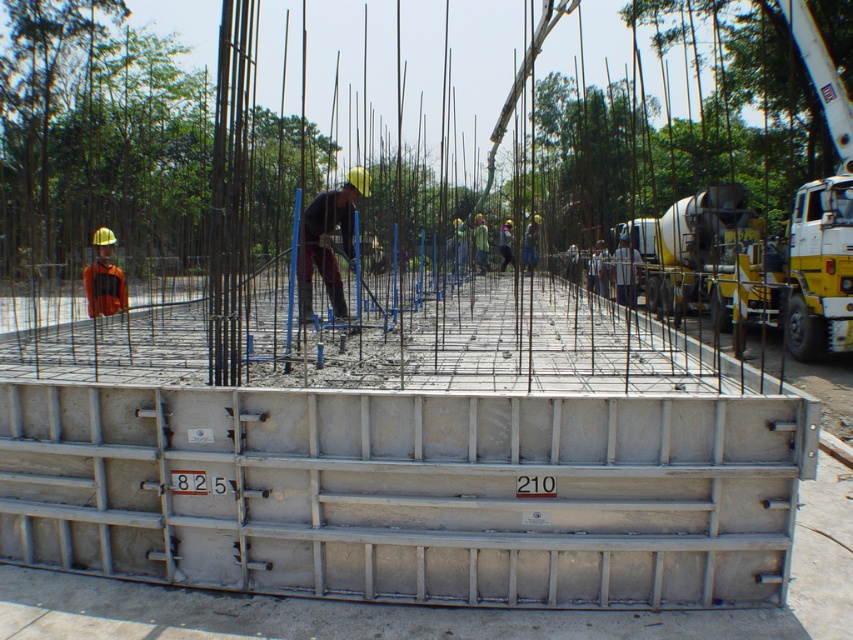
Who is higher up, silver metallic foundation at center or orange reflective vest at left?

Positioned higher is orange reflective vest at left.

Find the location of a particular element. silver metallic foundation at center is located at coordinates (409, 492).

Does point (366, 477) come farther from viewer compared to point (94, 304)?

No, it is in front of (94, 304).

At what (x,y) coordinates should I click in order to perform the action: click on silver metallic foundation at center. Please return your answer as a coordinate pair (x, y). This screenshot has width=853, height=640. Looking at the image, I should click on (409, 492).

Is silver metallic foundation at center above matte black helmet at center?

Incorrect, silver metallic foundation at center is not positioned above matte black helmet at center.

Who is more forward, [692,579] or [347,177]?

Point [692,579]

Identify the location of silver metallic foundation at center. This screenshot has width=853, height=640. (409, 492).

Who is lower down, matte black helmet at center or orange reflective vest at left?

matte black helmet at center is below.

Consider the image. Who is more forward, (x=357, y=188) or (x=115, y=268)?

Positioned in front is point (x=357, y=188).

Which is behind, point (351, 214) or point (94, 280)?

Point (94, 280)

Identify the location of matte black helmet at center. The height and width of the screenshot is (640, 853). (329, 241).